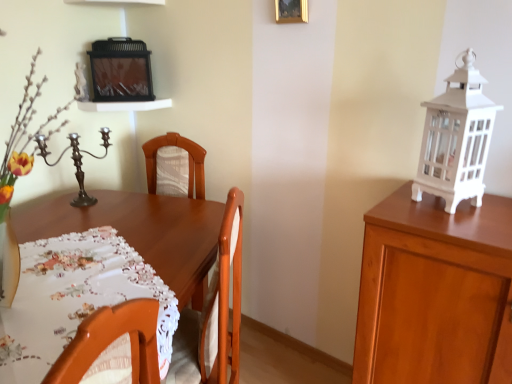
Question: In terms of width, does polished bronze candle holder at left look wider or thinner when compared to white wood cabinet at right?

Choices:
 (A) wide
 (B) thin

Answer: (B)

Question: Visually, is polished bronze candle holder at left positioned to the left or to the right of white wood cabinet at right?

Choices:
 (A) left
 (B) right

Answer: (A)

Question: Which is nearer to the polished bronze candle holder at left?

Choices:
 (A) white painted glass lantern at right
 (B) gold metallic picture frame at upper center
 (C) white printed tablecloth at center
 (D) white wood cabinet at right

Answer: (C)

Question: Which object is positioned closest to the gold metallic picture frame at upper center?

Choices:
 (A) polished bronze candle holder at left
 (B) white painted glass lantern at right
 (C) white printed tablecloth at center
 (D) white wood cabinet at right

Answer: (B)